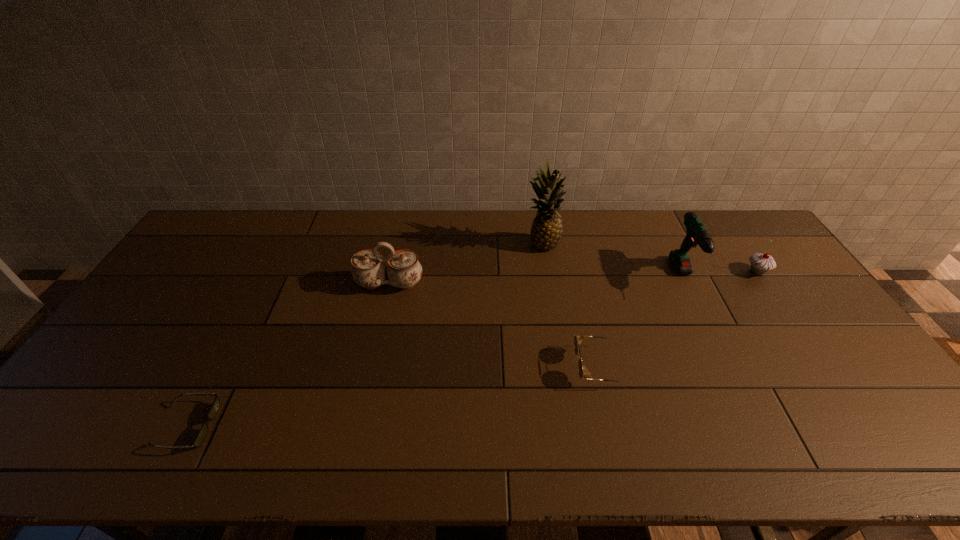
Locate an element on the screen. The width and height of the screenshot is (960, 540). object that is at the near edge is located at coordinates (202, 433).

Where is `object present at the right edge`? object present at the right edge is located at coordinates (761, 263).

Where is `vacant space at the far edge of the desktop`? This screenshot has height=540, width=960. vacant space at the far edge of the desktop is located at coordinates (719, 247).

Locate an element on the screen. free space at the near edge of the desktop is located at coordinates (305, 444).

In the image, there is a desktop. At what (x,y) coordinates should I click in order to perform the action: click on vacant space at the right edge. Please return your answer as a coordinate pair (x, y). Looking at the image, I should click on (794, 338).

Identify the location of vacant area at the far right corner. The image size is (960, 540). (761, 248).

Locate an element on the screen. The height and width of the screenshot is (540, 960). free space between the fifth object from left to right and the fourth shortest object is located at coordinates (538, 281).

Locate an element on the screen. This screenshot has width=960, height=540. free area in between the right sunglasses and the rightmost object is located at coordinates (678, 319).

At what (x,y) coordinates should I click in order to perform the action: click on free space between the tallest object and the fourth tallest object. Please return your answer as a coordinate pair (x, y). The height and width of the screenshot is (540, 960). Looking at the image, I should click on (650, 258).

The image size is (960, 540). I want to click on vacant space that is in between the cupcake and the shorter sunglasses, so click(x=471, y=349).